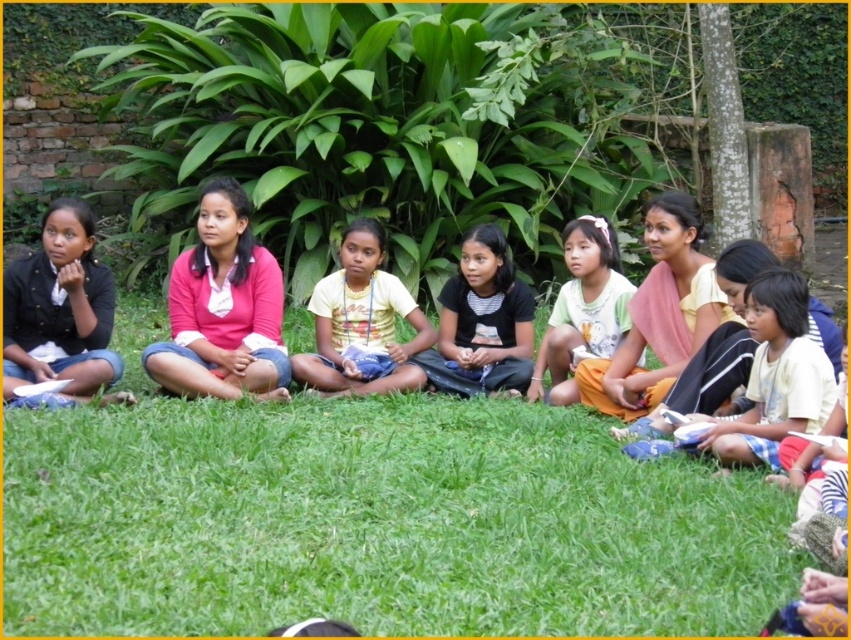
Question: Can you confirm if pink cotton shirt at center is wider than white cotton shirt at center?

Choices:
 (A) yes
 (B) no

Answer: (A)

Question: Which object is positioned farthest from the white cotton shirt at center?

Choices:
 (A) yellow matte shirt at center
 (B) pink cotton shirt at center

Answer: (B)

Question: Is green grass at center wider than yellow cotton skirt at center?

Choices:
 (A) yes
 (B) no

Answer: (A)

Question: Among these points, which one is nearest to the camera?

Choices:
 (A) (580, 324)
 (B) (69, 292)
 (C) (465, 356)
 (D) (802, 406)

Answer: (D)

Question: Which object appears closest to the camera in this image?

Choices:
 (A) black striped shirt at center
 (B) black matte jacket at left
 (C) pink cotton shirt at center

Answer: (B)

Question: Can you confirm if yellow matte shirt at center is wider than yellow cotton skirt at center?

Choices:
 (A) no
 (B) yes

Answer: (B)